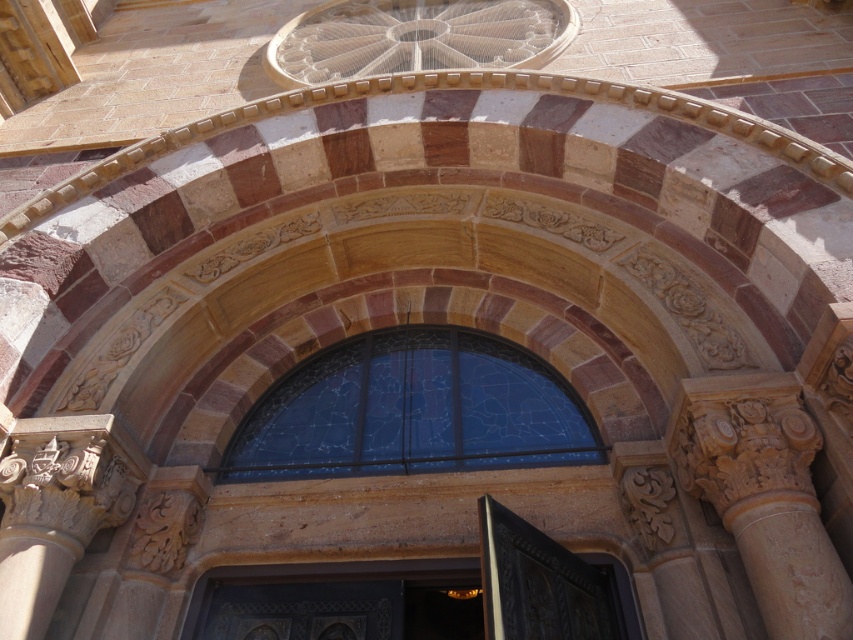
Question: Which object is the closest to the polished brass door at center?

Choices:
 (A) stained glass window at center
 (B) carved stone column at right

Answer: (B)

Question: Among these points, which one is farthest from the camera?

Choices:
 (A) (563, 612)
 (B) (404, 368)
 (C) (795, 632)

Answer: (B)

Question: Does carved stone column at right have a larger size compared to polished brass door at center?

Choices:
 (A) yes
 (B) no

Answer: (A)

Question: Is carved stone column at right to the right of polished brass door at center from the viewer's perspective?

Choices:
 (A) no
 (B) yes

Answer: (B)

Question: Which of the following is the farthest from the observer?

Choices:
 (A) stained glass window at center
 (B) polished brass door at center
 (C) carved stone column at right

Answer: (A)

Question: Does stained glass window at center appear on the right side of polished brass door at center?

Choices:
 (A) no
 (B) yes

Answer: (A)